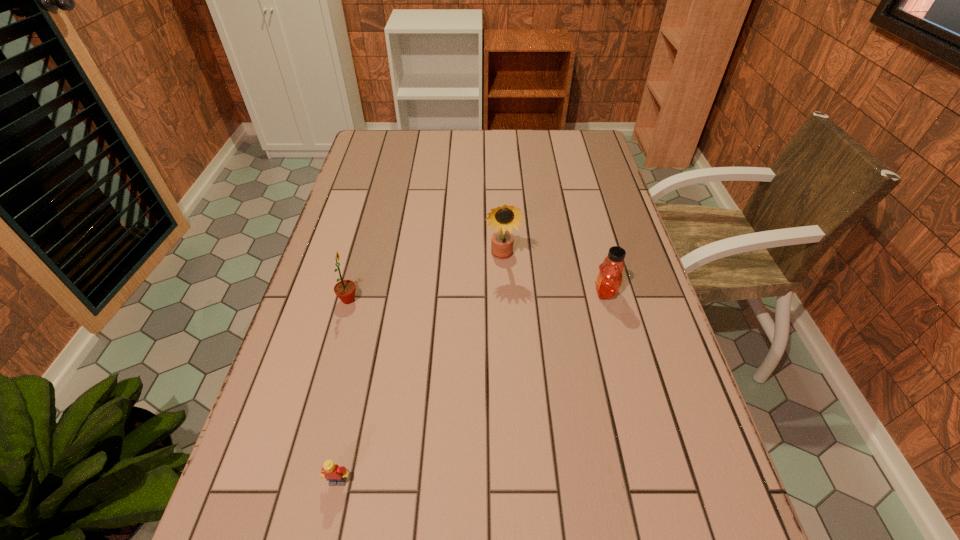
Locate which object is the closest to the leftmost object. Please provide its 2D coordinates. Your answer should be formatted as a tuple, i.e. [(x, y)], where the tuple contains the x and y coordinates of a point satisfying the conditions above.

[(503, 217)]

Where is `object identified as the third closest to the honey`? The width and height of the screenshot is (960, 540). object identified as the third closest to the honey is located at coordinates (336, 475).

What are the coordinates of `free region that satisfies the following two spatial constraints: 1. on the front label of the honey; 2. on the front-facing side of the Lego` in the screenshot? It's located at (655, 481).

Locate an element on the screen. vacant space that satisfies the following two spatial constraints: 1. on the front label of the third tallest object; 2. on the front-facing side of the shortest object is located at coordinates (655, 481).